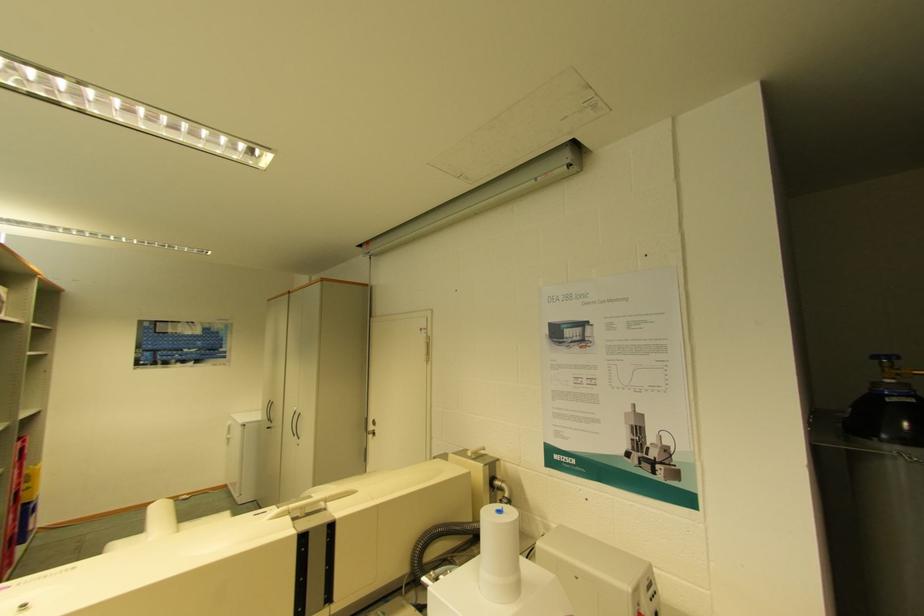
The image size is (924, 616). In order to click on white door handle in this screenshot , I will do `click(370, 428)`.